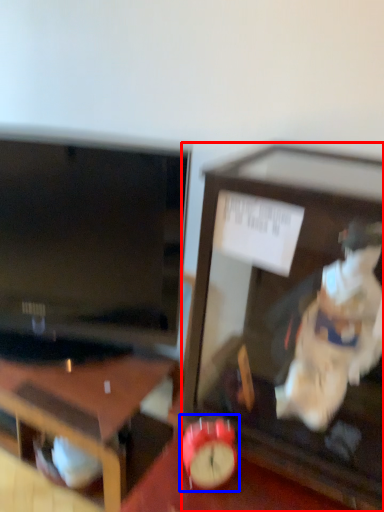
Question: Which object is further to the camera taking this photo, furniture (highlighted by a red box) or alarm clock (highlighted by a blue box)?

Choices:
 (A) furniture
 (B) alarm clock

Answer: (B)